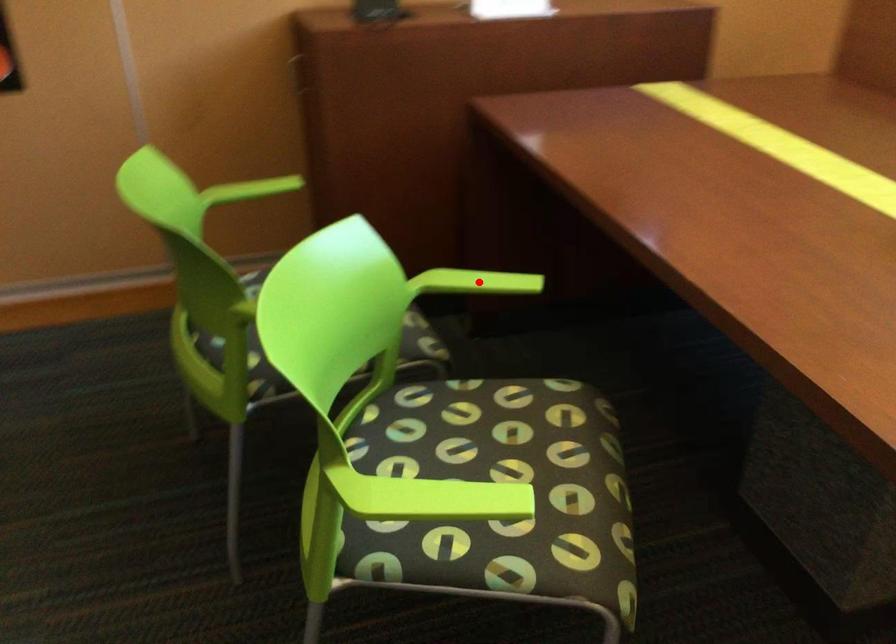
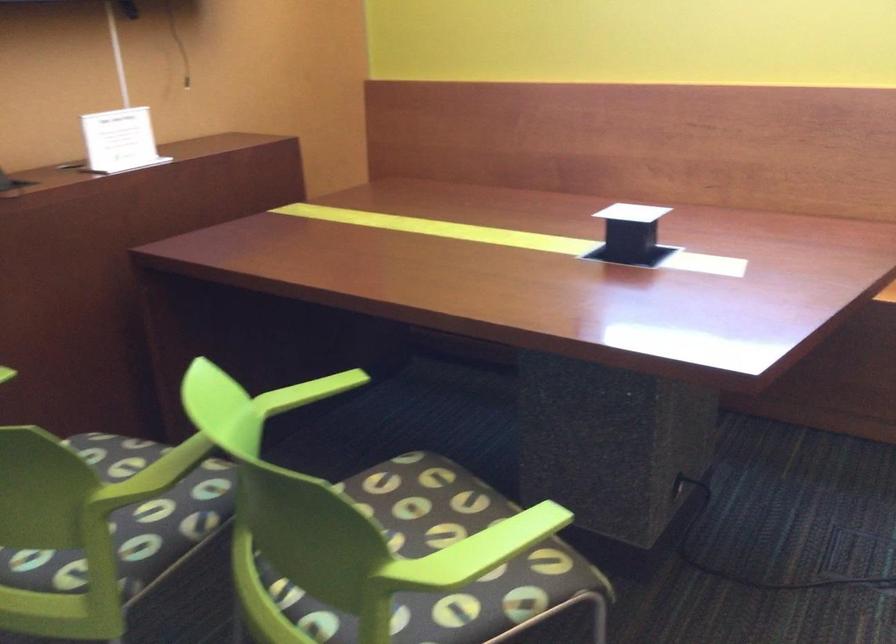
Find the pixel in the second image that matches the highlighted location in the first image.

(307, 392)